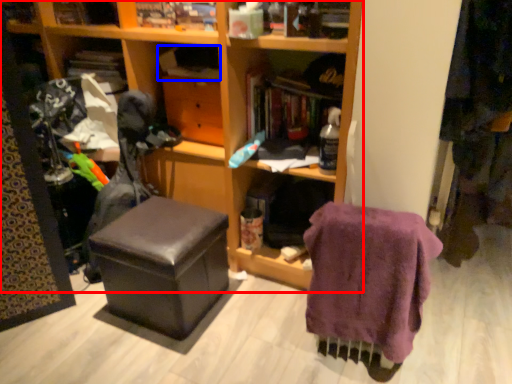
Question: Which point is closer to the camera, furniture (highlighted by a red box) or book (highlighted by a blue box)?

Choices:
 (A) furniture
 (B) book

Answer: (A)